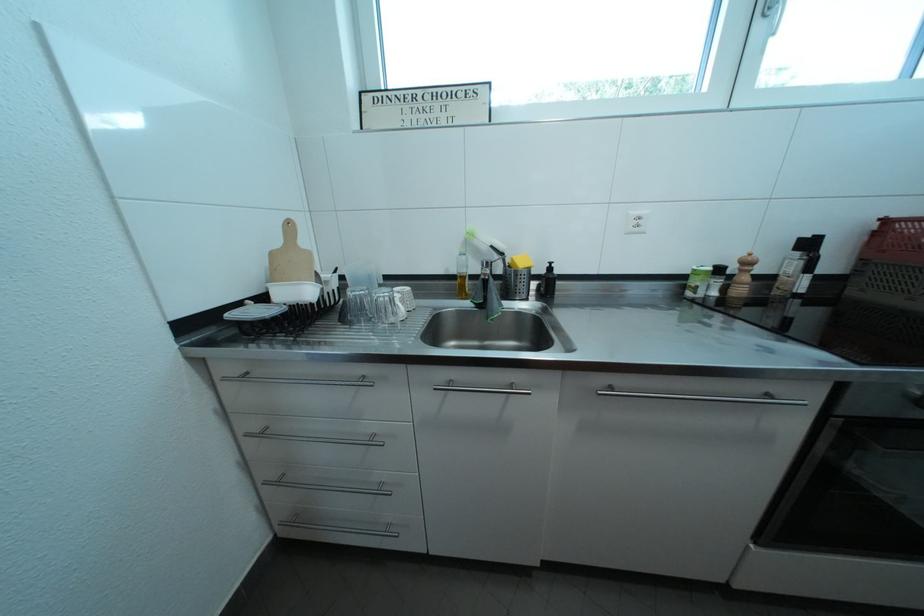
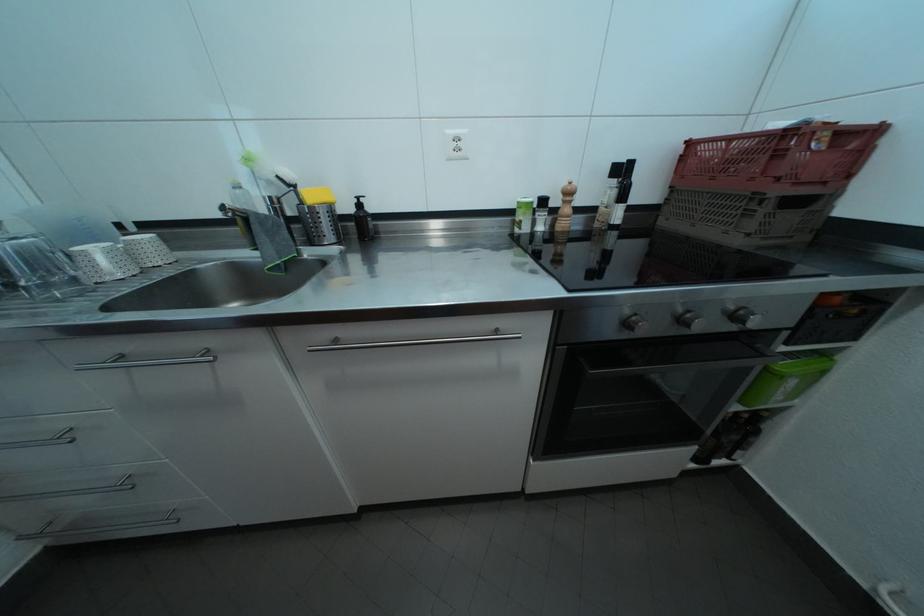
Locate, in the second image, the point that corresponds to [818,251] in the first image.

(630, 176)